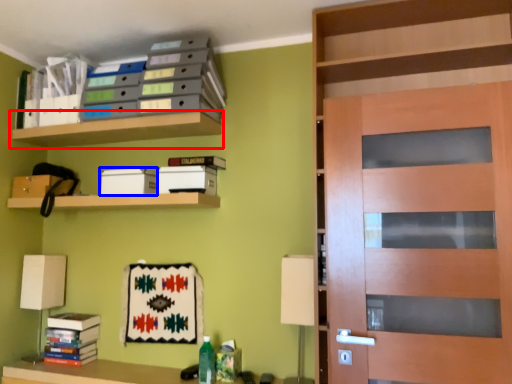
Question: Which of the following is the farthest to the observer, shelf (highlighted by a red box) or storage box (highlighted by a blue box)?

Choices:
 (A) shelf
 (B) storage box

Answer: (B)